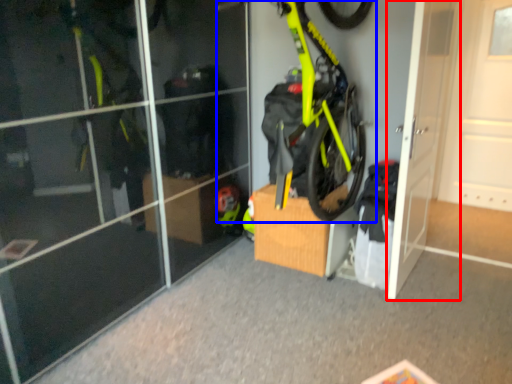
Question: Which point is closer to the camera, door (highlighted by a red box) or bicycle (highlighted by a blue box)?

Choices:
 (A) door
 (B) bicycle

Answer: (B)